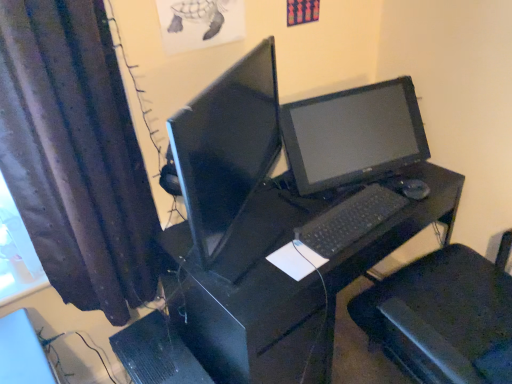
The height and width of the screenshot is (384, 512). In order to click on empty space that is ontop of black plastic desk at center (from a real-world perspective) in this screenshot , I will do `click(322, 218)`.